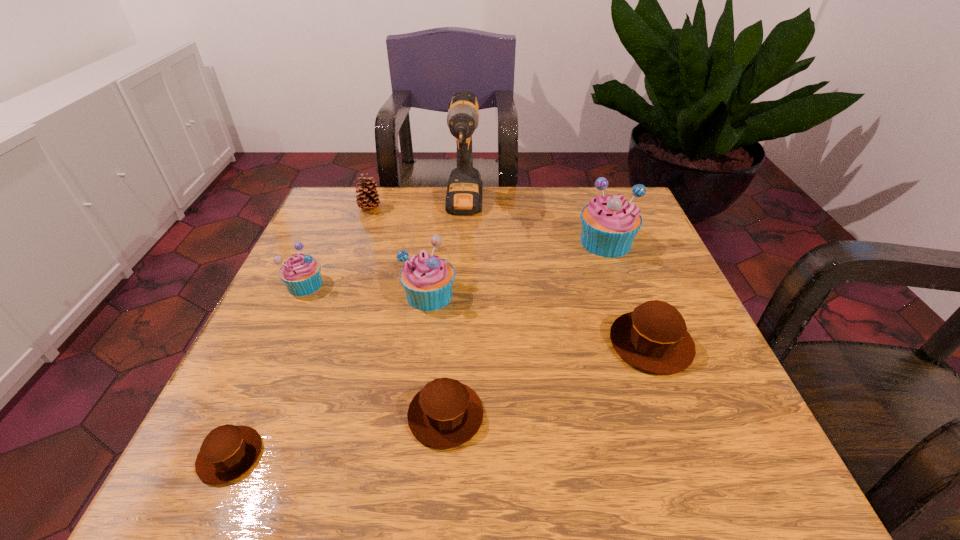
This screenshot has height=540, width=960. In order to click on the second smallest brown muffin in this screenshot , I will do `click(445, 414)`.

Where is `the smallest brown muffin`? The width and height of the screenshot is (960, 540). the smallest brown muffin is located at coordinates (229, 451).

At what (x,y) coordinates should I click in order to perform the action: click on the shortest muffin. Please return your answer as a coordinate pair (x, y). The height and width of the screenshot is (540, 960). Looking at the image, I should click on (229, 451).

At what (x,y) coordinates should I click in order to perform the action: click on vacant area situated 0.210m with the drill bit of the tallest object facing forward. Please return your answer as a coordinate pair (x, y). Looking at the image, I should click on (460, 291).

You are a GUI agent. You are given a task and a screenshot of the screen. Output one action in this format:
    pyautogui.click(x=<x>, y=<y>)
    Task: Click on the vacant space located on the front of the rightmost blue muffin
    
    Given the screenshot: What is the action you would take?
    pyautogui.click(x=636, y=326)

At what (x,y) coordinates should I click in order to perform the action: click on free space located 0.280m on the front of the second biggest blue muffin. Please return your answer as a coordinate pair (x, y). The height and width of the screenshot is (540, 960). Looking at the image, I should click on (410, 449).

I want to click on free space located on the right of the pinecone, so click(x=489, y=208).

I want to click on vacant area situated 0.130m on the front of the leftmost blue muffin, so click(276, 348).

Identify the location of vacant point located 0.070m on the back of the sixth farthest object. (631, 290).

Find the location of a particular element. This screenshot has width=960, height=540. blank space located 0.230m on the left of the second brown muffin from right to left is located at coordinates (263, 415).